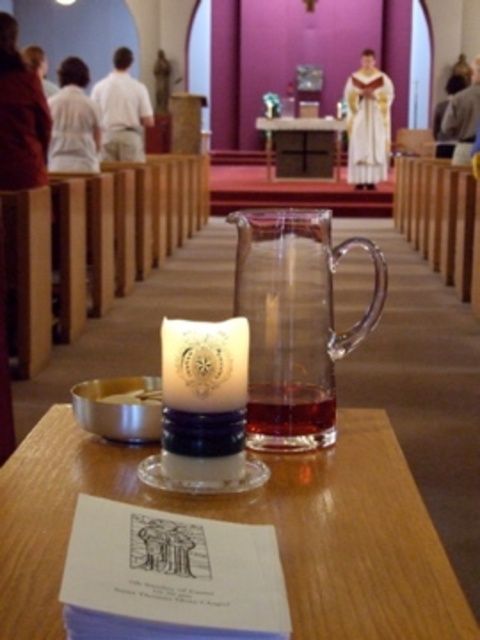
Looking at this image, who is positioned more to the left, white wax candle at center or transparent glass table at center?

From the viewer's perspective, white wax candle at center appears more on the left side.

Can you confirm if white wax candle at center is taller than transparent glass table at center?

Incorrect, white wax candle at center's height is not larger of transparent glass table at center's.

Who is more distant from viewer, (167, 360) or (331, 122)?

Point (331, 122)

Identify the location of white wax candle at center. The width and height of the screenshot is (480, 640). (204, 364).

Consider the image. Who is more distant from viewer, (31, 497) or (298, 120)?

Positioned behind is point (298, 120).

Between translucent glass table at center and transparent glass table at center, which one is positioned lower?

Positioned lower is translucent glass table at center.

Image resolution: width=480 pixels, height=640 pixels. I want to click on translucent glass table at center, so click(250, 522).

How distant is transparent glass jug at center from transparent glass table at center?

transparent glass jug at center and transparent glass table at center are 8.92 meters apart from each other.

Does transparent glass jug at center have a lesser width compared to transparent glass table at center?

Yes.

Is point (282, 397) behind point (336, 129)?

That is False.

Locate an element on the screen. The image size is (480, 640). transparent glass jug at center is located at coordinates (295, 323).